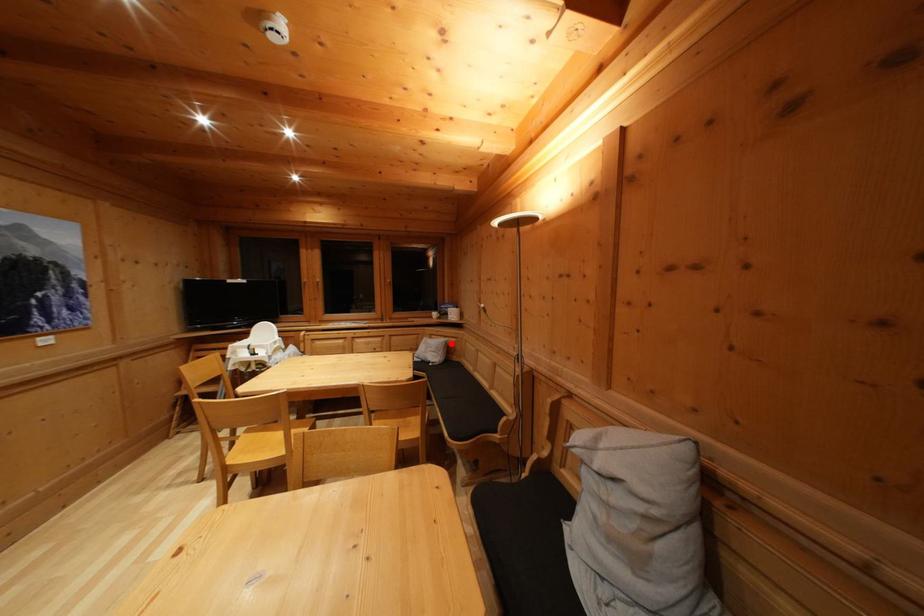
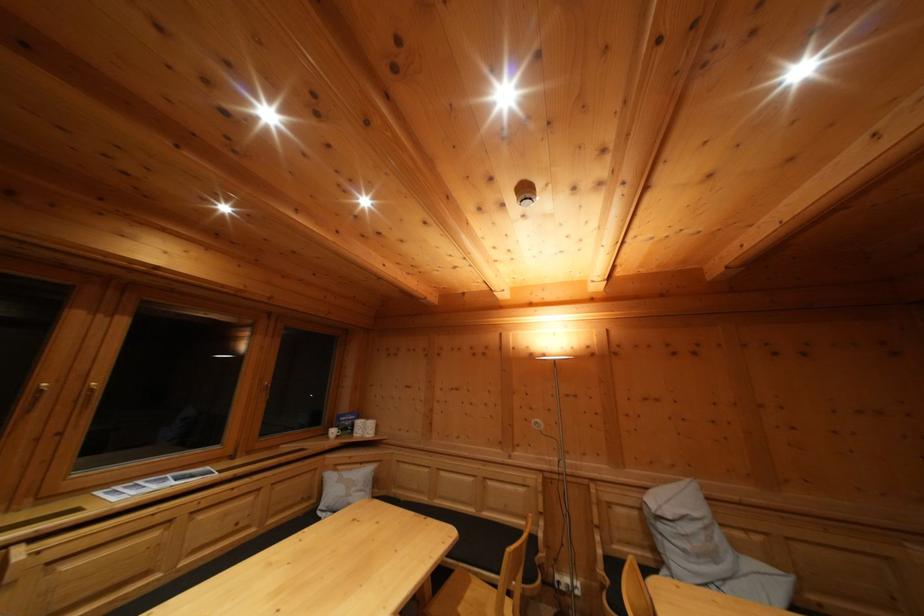
In the second image, find the point that corresponds to the highlighted location in the first image.

(368, 469)